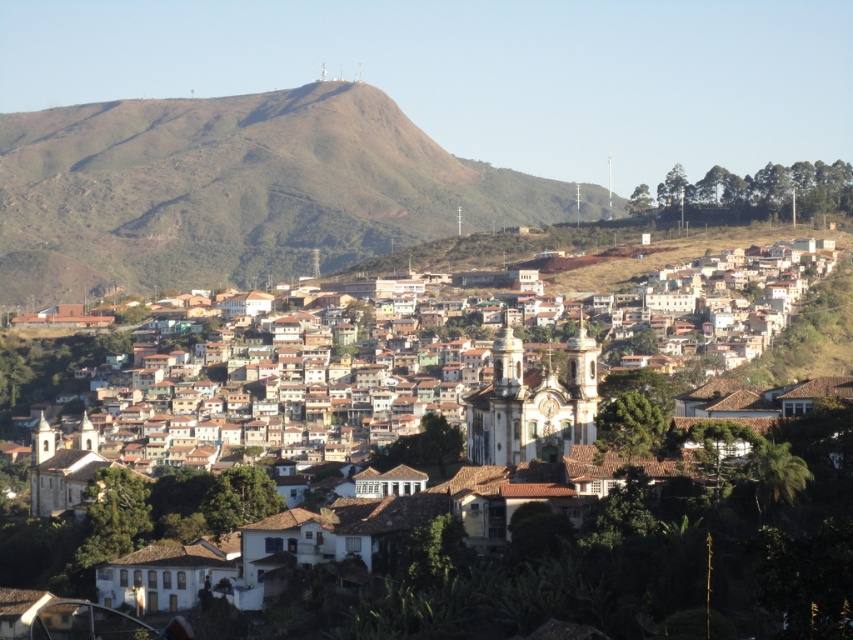
You are a drone operator trying to capture a photo of the brown clay roof tiles at center and the green grassy hill at upper center. Which object will appear smaller in the photo?

The brown clay roof tiles at center will appear smaller in the photo because it is not as tall as the green grassy hill at upper center, so the hill will take up more space in the image.

You are a tourist standing in the town square and want to take a photo of the brown clay roof tiles at center and the green grassy hill at upper center. Which object should you point your camera towards first to capture both in the same frame?

You should point your camera towards the green grassy hill at upper center first because the brown clay roof tiles at center is positioned under it, so adjusting the angle to include both would require framing from the higher position first.